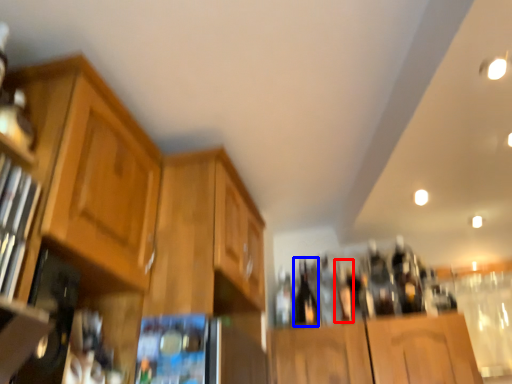
Question: Among these objects, which one is nearest to the camera, bottle (highlighted by a red box) or beer bottle (highlighted by a blue box)?

Choices:
 (A) bottle
 (B) beer bottle

Answer: (A)